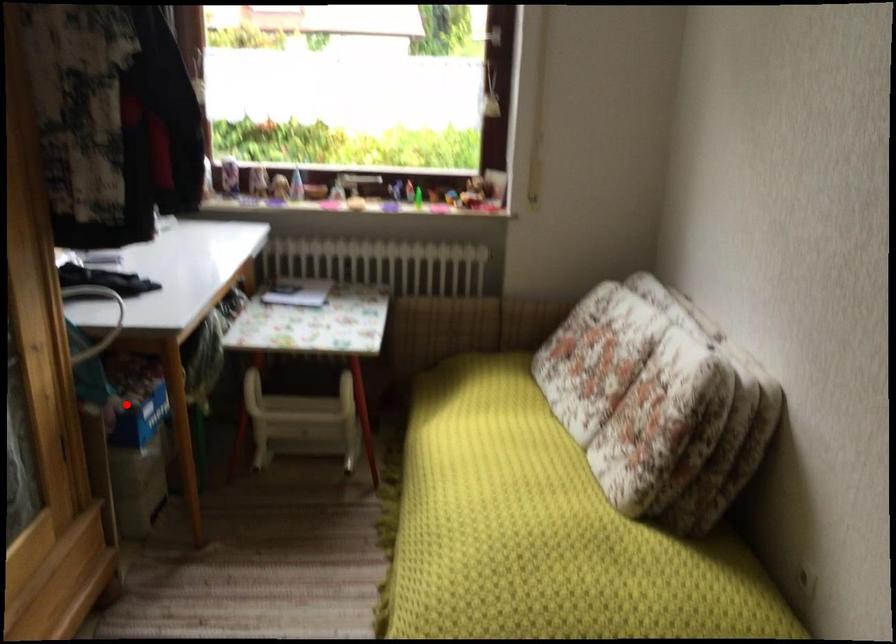
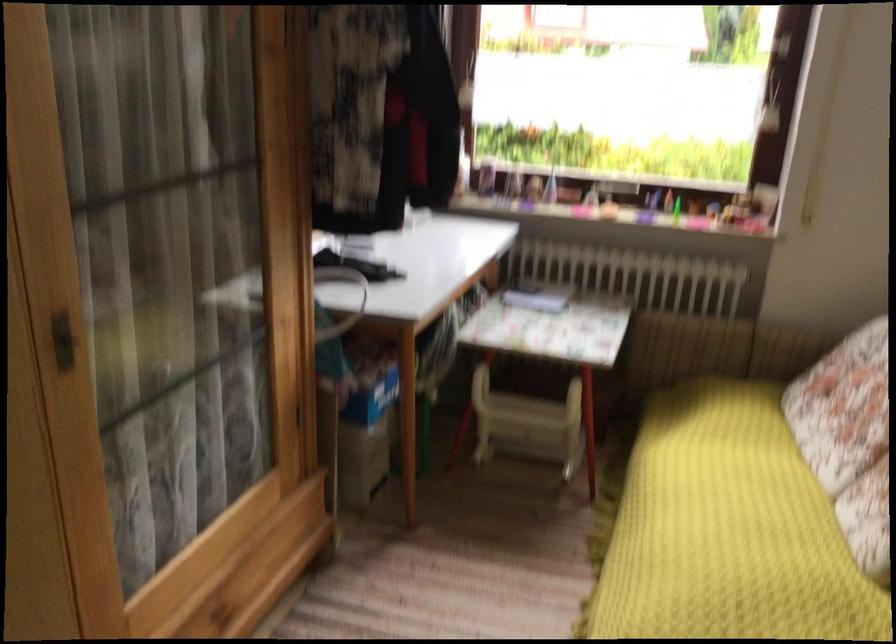
Where in the second image is the point corresponding to the highlighted location from the first image?

(360, 381)